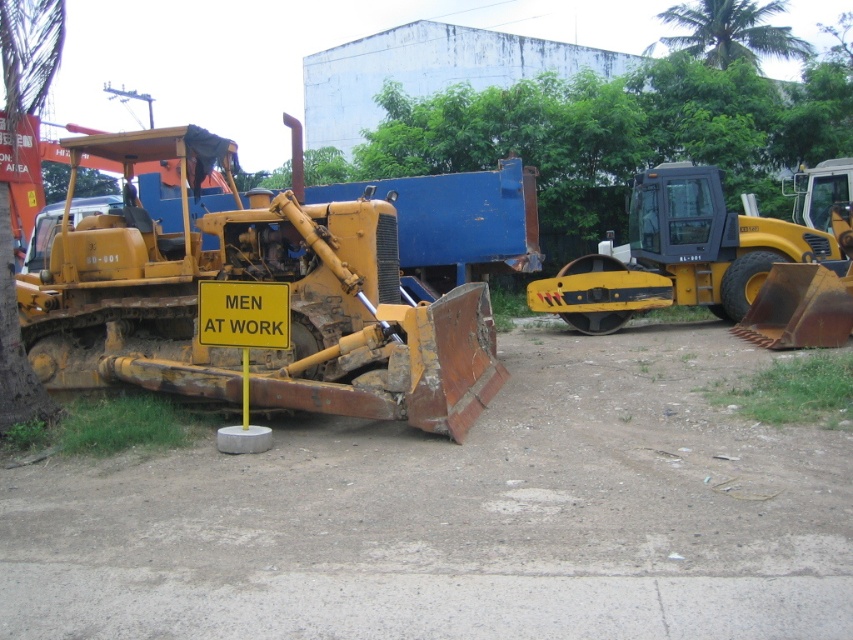
You are a construction worker standing near the yellow metallic tractor at left and need to reach the green leafy tree at upper center for a safety inspection. Which direction should you move to get closer to the tree?

Since the yellow metallic tractor at left is closer to the viewer than the green leafy tree at upper center, you should move forward towards the tree to get closer.

You are a delivery driver who needs to transport a large crate that requires a path wider than the yellow metallic tractor at left. Can the dirt track at center accommodate your delivery vehicle?

The dirt track at center is smaller than the yellow metallic tractor at left, so it cannot accommodate a vehicle larger than the tractor, meaning the delivery vehicle likely cannot pass through.